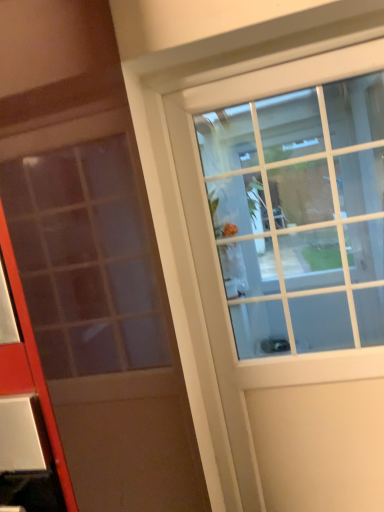
Locate an element on the screen. The image size is (384, 512). white glass door at upper right, placed as the second door when sorted from front to back is located at coordinates (219, 268).

Describe the element at coordinates (219, 268) in the screenshot. I see `white glass door at upper right, the second door positioned from the left` at that location.

Image resolution: width=384 pixels, height=512 pixels. What do you see at coordinates (100, 311) in the screenshot? I see `matte glass door at center, which is the first door in front-to-back order` at bounding box center [100, 311].

Where is `matte glass door at center, marked as the second door in a back-to-front arrangement`? The height and width of the screenshot is (512, 384). matte glass door at center, marked as the second door in a back-to-front arrangement is located at coordinates pyautogui.click(x=100, y=311).

You are a GUI agent. You are given a task and a screenshot of the screen. Output one action in this format:
    pyautogui.click(x=<x>, y=<y>)
    Task: Click on the white glass door at upper right, the second door positioned from the left
    This screenshot has width=384, height=512.
    Given the screenshot: What is the action you would take?
    coord(219,268)

Considering the positions of objects white glass door at upper right, the 1th door when ordered from back to front, and matte glass door at center, which is the 1th door in left-to-right order, in the image provided, who is more to the right, white glass door at upper right, the 1th door when ordered from back to front, or matte glass door at center, which is the 1th door in left-to-right order,?

Positioned to the right is white glass door at upper right, the 1th door when ordered from back to front.

Is the depth of white glass door at upper right, placed as the second door when sorted from front to back, greater than that of matte glass door at center, marked as the second door in a back-to-front arrangement?

Yes, the depth of white glass door at upper right, placed as the second door when sorted from front to back, is greater than that of matte glass door at center, marked as the second door in a back-to-front arrangement.

Considering the positions of point (336, 442) and point (79, 503), is point (336, 442) closer or farther from the camera than point (79, 503)?

Clearly, point (336, 442) is more distant from the camera than point (79, 503).

Based on the photo, from the image's perspective, which one is positioned lower, white glass door at upper right, the second door positioned from the left, or matte glass door at center, which is the first door in front-to-back order?

white glass door at upper right, the second door positioned from the left, appears lower in the image.

From a real-world perspective, which object rests below the other?

white glass door at upper right, the second door positioned from the left, from a real-world perspective.

Does white glass door at upper right, placed as the second door when sorted from front to back, have a lesser width compared to matte glass door at center, marked as the second door in a back-to-front arrangement?

Indeed, white glass door at upper right, placed as the second door when sorted from front to back, has a lesser width compared to matte glass door at center, marked as the second door in a back-to-front arrangement.

Is white glass door at upper right, the second door positioned from the left, taller than matte glass door at center, which is the first door in front-to-back order?

Yes, white glass door at upper right, the second door positioned from the left, is taller than matte glass door at center, which is the first door in front-to-back order.

Based on their sizes in the image, would you say white glass door at upper right, placed as the second door when sorted from front to back, is bigger or smaller than matte glass door at center, marked as the second door in a back-to-front arrangement?

white glass door at upper right, placed as the second door when sorted from front to back, is smaller than matte glass door at center, marked as the second door in a back-to-front arrangement.

Would you say white glass door at upper right, the second door positioned from the left, is inside or outside matte glass door at center, which is the first door in front-to-back order?

white glass door at upper right, the second door positioned from the left, is outside matte glass door at center, which is the first door in front-to-back order.

Is white glass door at upper right, placed as the second door when sorted from front to back, positioned far away from matte glass door at center, marked as the second door in a back-to-front arrangement?

No, white glass door at upper right, placed as the second door when sorted from front to back, is not far away from matte glass door at center, marked as the second door in a back-to-front arrangement.

Could you tell me if white glass door at upper right, the 1th door when ordered from right to left, is turned towards matte glass door at center, which is the second door from right to left?

No, white glass door at upper right, the 1th door when ordered from right to left, is not aimed at matte glass door at center, which is the second door from right to left.

How different are the orientations of white glass door at upper right, placed as the second door when sorted from front to back, and matte glass door at center, marked as the second door in a back-to-front arrangement, in degrees?

The angular difference between white glass door at upper right, placed as the second door when sorted from front to back, and matte glass door at center, marked as the second door in a back-to-front arrangement, is 2.27 degrees.

Find the location of `door above the white glass door at upper right, the second door positioned from the left (from a real-world perspective)`. door above the white glass door at upper right, the second door positioned from the left (from a real-world perspective) is located at coordinates (100, 311).

Which is more to the right, matte glass door at center, which is the second door from right to left, or white glass door at upper right, the second door positioned from the left?

Positioned to the right is white glass door at upper right, the second door positioned from the left.

Considering their positions, is matte glass door at center, which is the first door in front-to-back order, located in front of or behind white glass door at upper right, placed as the second door when sorted from front to back?

Clearly, matte glass door at center, which is the first door in front-to-back order, is in front of white glass door at upper right, placed as the second door when sorted from front to back.

Is point (195, 488) in front of point (284, 406)?

Yes, it is.

From the image's perspective, would you say matte glass door at center, marked as the second door in a back-to-front arrangement, is positioned over white glass door at upper right, the second door positioned from the left?

Yes, from the image's perspective, matte glass door at center, marked as the second door in a back-to-front arrangement, is over white glass door at upper right, the second door positioned from the left.

From a real-world perspective, is matte glass door at center, which is the 1th door in left-to-right order, on top of white glass door at upper right, the 1th door when ordered from right to left?

Yes, from a real-world perspective, matte glass door at center, which is the 1th door in left-to-right order, is over white glass door at upper right, the 1th door when ordered from right to left

Which of these two, matte glass door at center, which is the second door from right to left, or white glass door at upper right, the 1th door when ordered from right to left, is wider?

Wider between the two is matte glass door at center, which is the second door from right to left.

Considering the relative sizes of matte glass door at center, which is the 1th door in left-to-right order, and white glass door at upper right, placed as the second door when sorted from front to back, in the image provided, is matte glass door at center, which is the 1th door in left-to-right order, taller than white glass door at upper right, placed as the second door when sorted from front to back,?

No.

Considering the sizes of matte glass door at center, which is the 1th door in left-to-right order, and white glass door at upper right, the 1th door when ordered from right to left, in the image, is matte glass door at center, which is the 1th door in left-to-right order, bigger or smaller than white glass door at upper right, the 1th door when ordered from right to left,?

In the image, matte glass door at center, which is the 1th door in left-to-right order, appears to be larger than white glass door at upper right, the 1th door when ordered from right to left.

Do you think matte glass door at center, which is the first door in front-to-back order, is within white glass door at upper right, the second door positioned from the left, or outside of it?

matte glass door at center, which is the first door in front-to-back order, is not inside white glass door at upper right, the second door positioned from the left, it's outside.

Based on the photo, is matte glass door at center, which is the 1th door in left-to-right order, far away from white glass door at upper right, placed as the second door when sorted from front to back?

No, matte glass door at center, which is the 1th door in left-to-right order, is in close proximity to white glass door at upper right, placed as the second door when sorted from front to back.

Could you tell me if matte glass door at center, marked as the second door in a back-to-front arrangement, is turned towards white glass door at upper right, the 1th door when ordered from back to front?

No, matte glass door at center, marked as the second door in a back-to-front arrangement, is not turned towards white glass door at upper right, the 1th door when ordered from back to front.

What's the angular difference between matte glass door at center, which is the 1th door in left-to-right order, and white glass door at upper right, the 1th door when ordered from back to front,'s facing directions?

matte glass door at center, which is the 1th door in left-to-right order, and white glass door at upper right, the 1th door when ordered from back to front, are facing 2.27 degrees away from each other.

Locate an element on the screen. The height and width of the screenshot is (512, 384). door on the right side of matte glass door at center, which is the first door in front-to-back order is located at coordinates (219, 268).

The height and width of the screenshot is (512, 384). I want to click on door above the white glass door at upper right, the 1th door when ordered from right to left (from a real-world perspective), so click(100, 311).

In order to click on door below the matte glass door at center, which is the second door from right to left (from a real-world perspective) in this screenshot , I will do `click(219, 268)`.